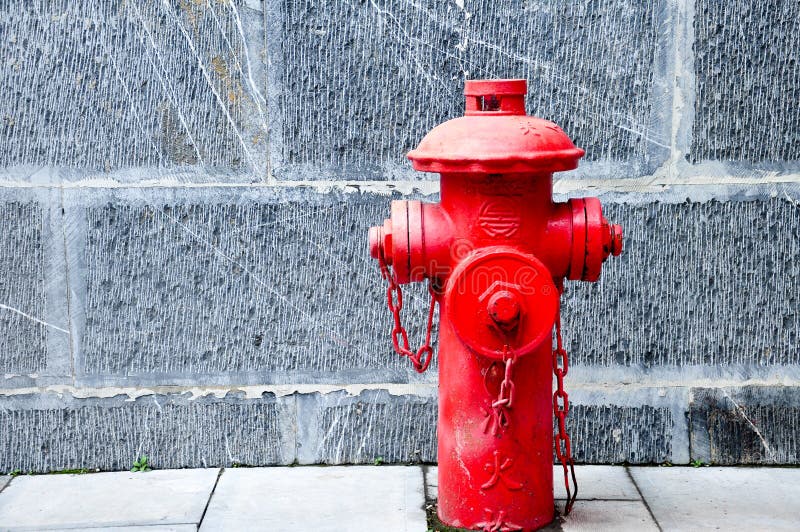
Find the location of a particular element. This screenshot has width=800, height=532. outlet cap is located at coordinates pyautogui.click(x=382, y=240).